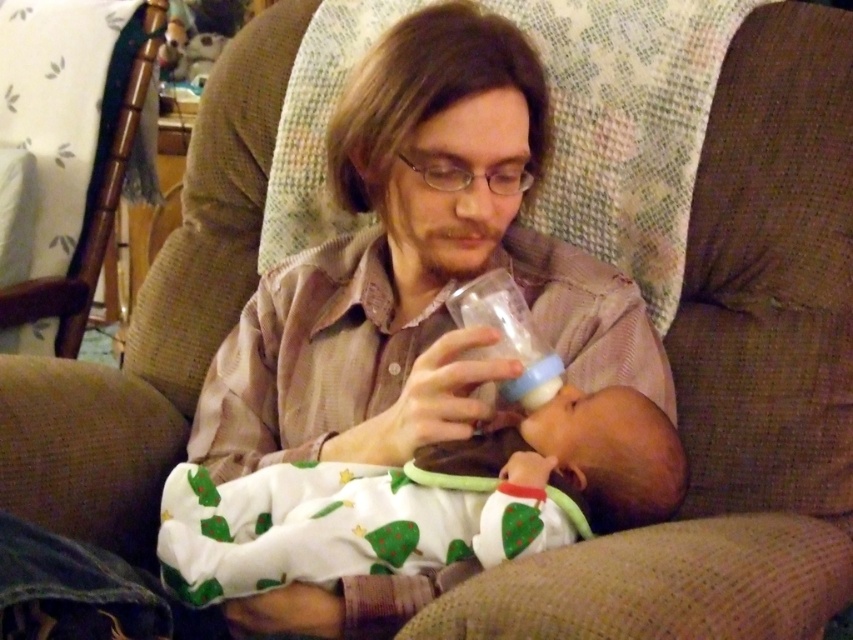
Question: Which of the following is the closest to the observer?

Choices:
 (A) (223, 584)
 (B) (473, 296)

Answer: (A)

Question: Among these objects, which one is farthest from the camera?

Choices:
 (A) transparent plastic bottle at center
 (B) white soft fabric baby at center

Answer: (A)

Question: Which point is closer to the camera taking this photo?

Choices:
 (A) (286, 566)
 (B) (503, 321)

Answer: (A)

Question: Can you confirm if white soft fabric baby at center is smaller than transparent plastic bottle at center?

Choices:
 (A) yes
 (B) no

Answer: (B)

Question: Can you confirm if white soft fabric baby at center is positioned to the right of transparent plastic bottle at center?

Choices:
 (A) yes
 (B) no

Answer: (B)

Question: Is white soft fabric baby at center bigger than transparent plastic bottle at center?

Choices:
 (A) no
 (B) yes

Answer: (B)